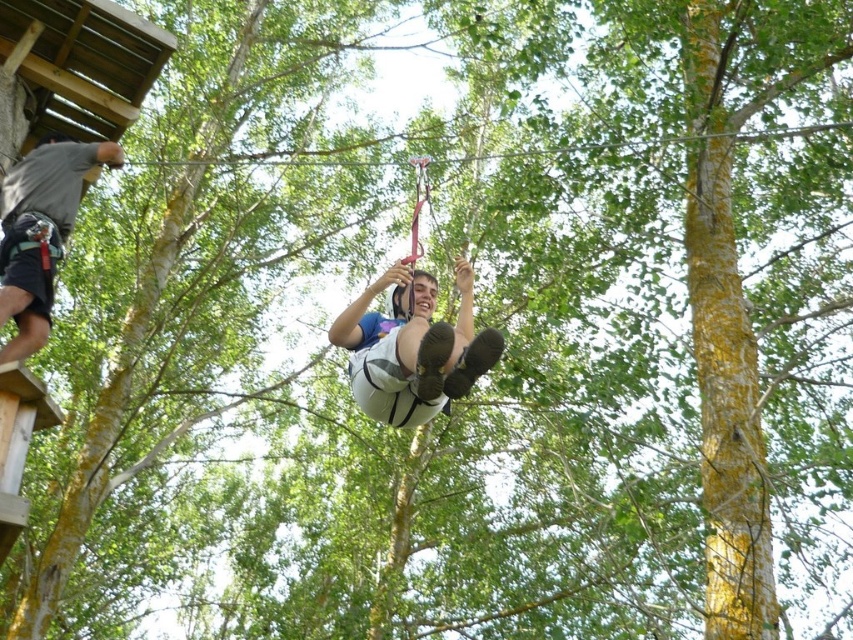
Is point (421, 417) less distant than point (64, 214)?

That is True.

Can you confirm if white fabric harness at center is positioned below gray fabric harness at upper left?

Correct, white fabric harness at center is located below gray fabric harness at upper left.

Locate an element on the screen. white fabric harness at center is located at coordinates (413, 348).